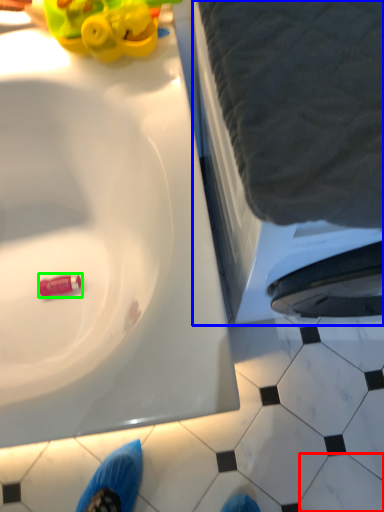
Question: Which object is the closest to the tile (highlighted by a red box)? Choose among these: bath (highlighted by a blue box) or toy (highlighted by a green box).

Choices:
 (A) bath
 (B) toy

Answer: (A)